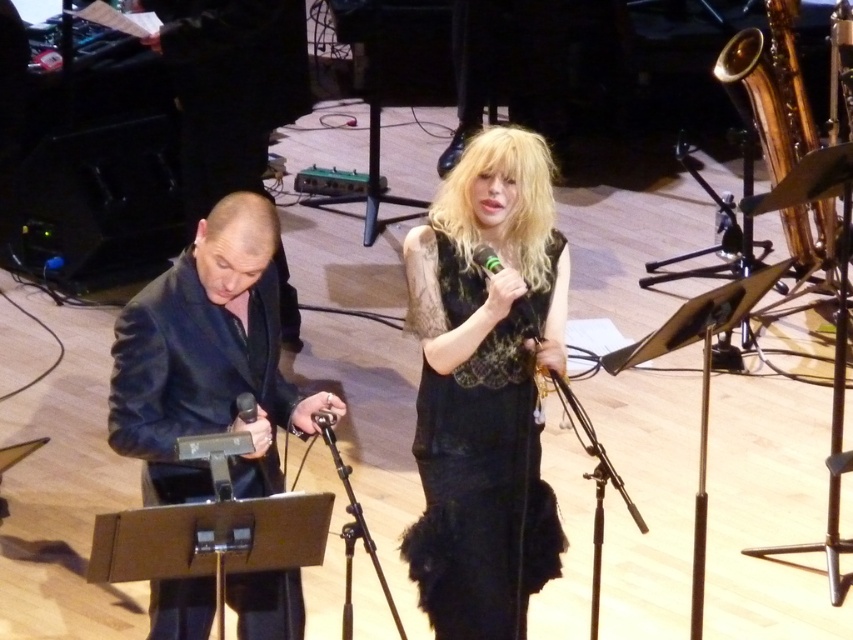
You are a stagehand setting up equipment for a performance. You have a gold brass saxophone at upper right and a green metallic microphone at center. Which object requires more space to place on the stage?

The gold brass saxophone at upper right requires more space because it is bigger than the green metallic microphone at center.

From the picture: You are a stagehand who needs to move the dark blue suit at left and the gold brass saxophone at upper right to the storage room. Since the storage room entrance is on the left side of the stage, which object should you move first to avoid blocking the other?

You should move the gold brass saxophone at upper right first because the dark blue suit at left is to the left of it, so moving the saxophone first will prevent blocking the suit when exiting through the left side storage room entrance.

You are a photographer adjusting your camera settings to focus on two points on stage. The first point is at coordinates point (757, 67) and the second is at point (524, 298). Which point should you focus on first if you want to capture the performer closest to the camera?

Point (757, 67) is further to the camera than point (524, 298), so you should focus on point (757, 67) first to capture the performer closest to the camera.